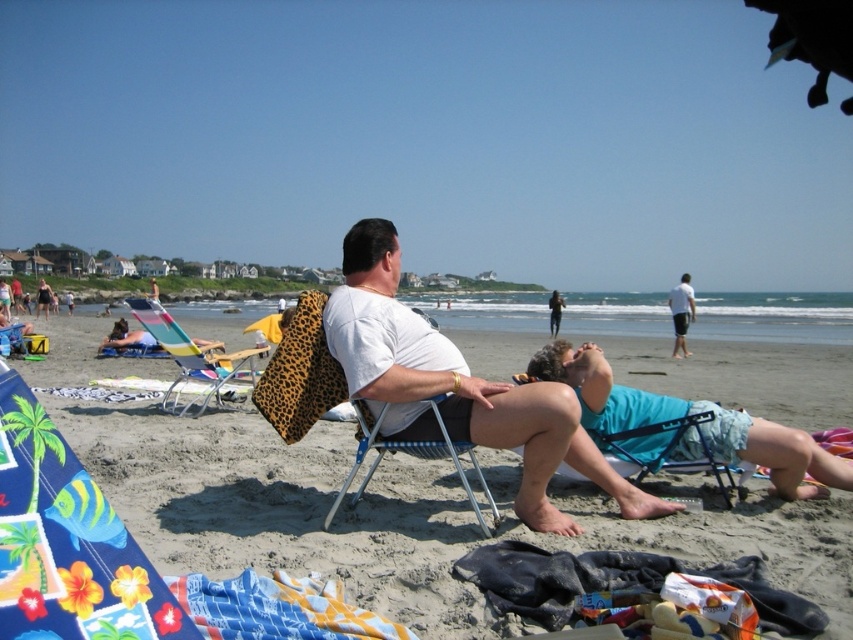
Question: Is the position of blue fabric shorts at lower right more distant than that of teal fabric chair at lower right?

Choices:
 (A) yes
 (B) no

Answer: (B)

Question: Which object is positioned closest to the light blue shorts at center?

Choices:
 (A) blue fabric shorts at lower right
 (B) metallic blue beach chair at center

Answer: (A)

Question: Which of these objects is positioned farthest from the metallic blue beach chair at center?

Choices:
 (A) white matte shirt at center
 (B) light blue shorts at center

Answer: (B)

Question: In this image, where is white cotton shirt at center located relative to white matte shirt at center?

Choices:
 (A) above
 (B) below

Answer: (B)

Question: In this image, where is white cotton shirt at center located relative to blue fabric shorts at lower right?

Choices:
 (A) below
 (B) above

Answer: (B)

Question: Which point is closer to the camera?

Choices:
 (A) (553, 532)
 (B) (686, 284)
 (C) (209, 384)
 (D) (286, 570)

Answer: (D)